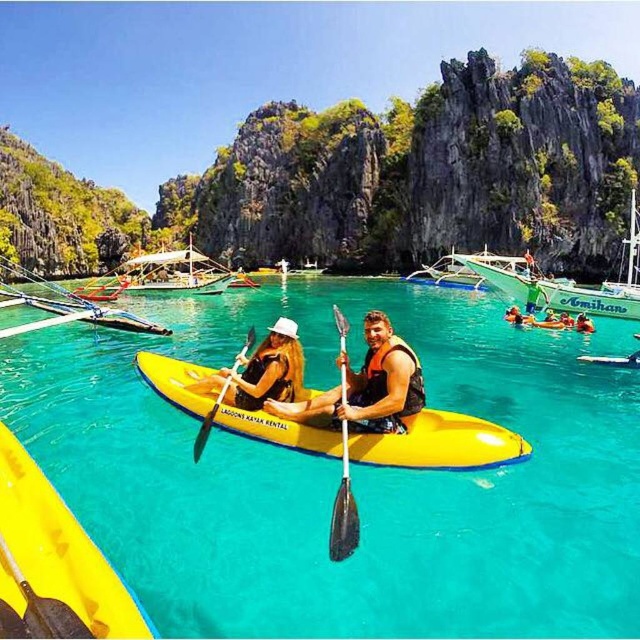
Is matte yellow kayak at center closer to the viewer compared to green plastic boat at upper right?

Yes, matte yellow kayak at center is in front of green plastic boat at upper right.

Is matte yellow kayak at center below green plastic boat at upper right?

Yes.

Who is more forward, (349,401) or (628,307)?

Point (349,401)

Identify the location of matte yellow kayak at center. (368, 387).

Is the position of matte black kayak at center less distant than that of yellow life vest at center?

Yes.

Is matte black kayak at center shorter than yellow life vest at center?

Incorrect, matte black kayak at center's height does not fall short of yellow life vest at center's.

Who is more forward, [264,349] or [580,324]?

Positioned in front is point [264,349].

Locate an element on the screen. This screenshot has width=640, height=640. matte black kayak at center is located at coordinates (260, 371).

Who is lower down, matte black kayak at center or white wooden boat at center?

matte black kayak at center is lower down.

Between matte black kayak at center and white wooden boat at center, which one has less height?

Standing shorter between the two is matte black kayak at center.

Find the location of `matte black kayak at center`. matte black kayak at center is located at coordinates (260, 371).